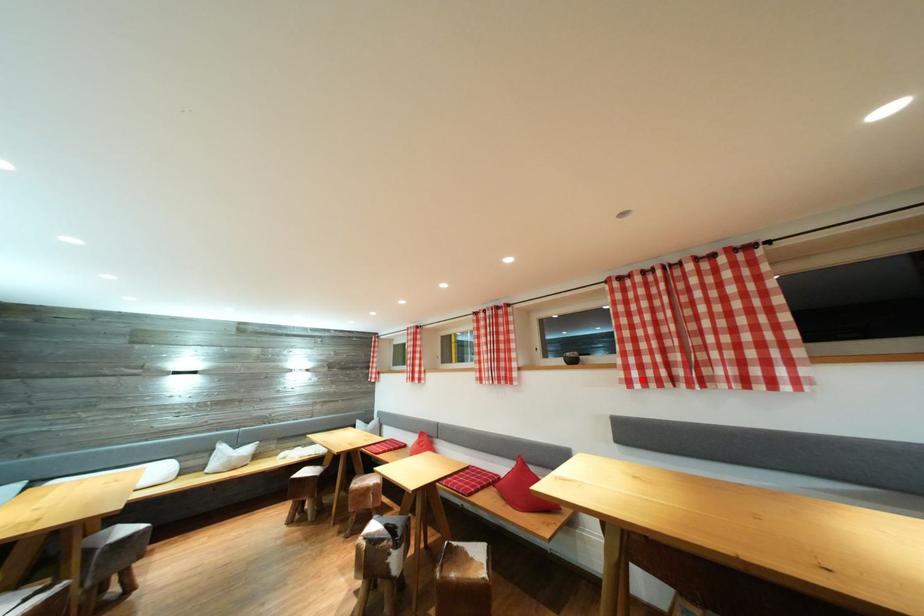
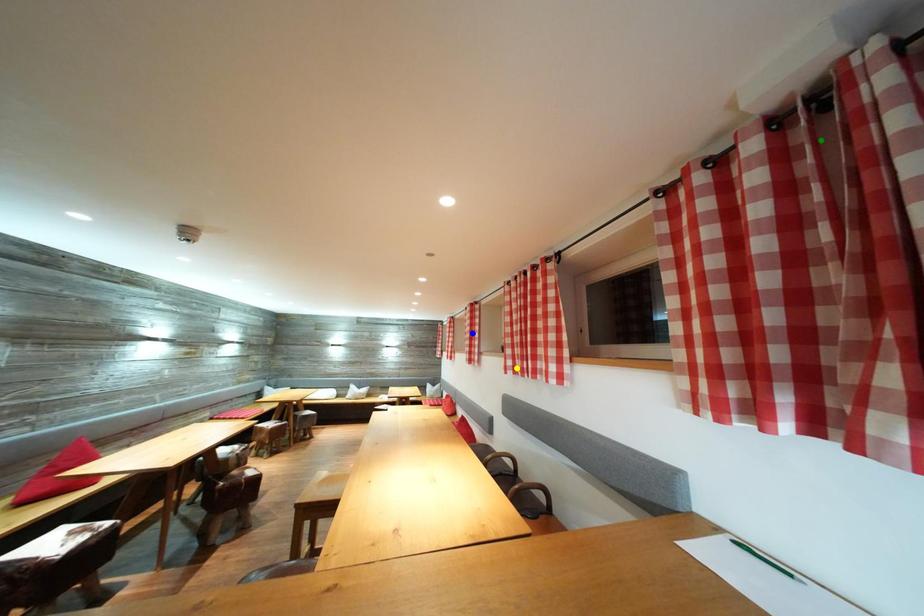
Question: I am providing you with two images of the same scene from different viewpoints. A red point is marked on the first image. You are given multiple points on the second image. Which mark in image 2 goes with the point in image 1?

Choices:
 (A) yellow point
 (B) blue point
 (C) green point

Answer: (A)